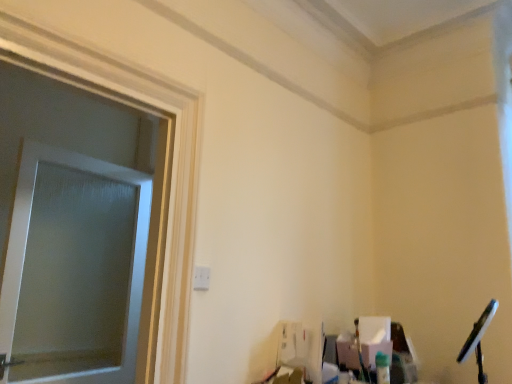
Question: Is white wood frame at left bigger than frosted glass window screen at left?

Choices:
 (A) no
 (B) yes

Answer: (B)

Question: From the image's perspective, is white wood frame at left on top of frosted glass window screen at left?

Choices:
 (A) no
 (B) yes

Answer: (B)

Question: Is frosted glass window screen at left at the back of white wood frame at left?

Choices:
 (A) no
 (B) yes

Answer: (B)

Question: Is white wood frame at left shorter than frosted glass window screen at left?

Choices:
 (A) no
 (B) yes

Answer: (A)

Question: Is white wood frame at left wider than frosted glass window screen at left?

Choices:
 (A) no
 (B) yes

Answer: (B)

Question: Is the surface of white wood frame at left in direct contact with frosted glass window screen at left?

Choices:
 (A) no
 (B) yes

Answer: (A)

Question: Considering the relative sizes of frosted glass window screen at left and white wood frame at left in the image provided, is frosted glass window screen at left wider than white wood frame at left?

Choices:
 (A) no
 (B) yes

Answer: (A)

Question: Is frosted glass window screen at left next to white wood frame at left?

Choices:
 (A) yes
 (B) no

Answer: (B)

Question: Can you confirm if frosted glass window screen at left is thinner than white wood frame at left?

Choices:
 (A) no
 (B) yes

Answer: (B)

Question: Is frosted glass window screen at left located outside white wood frame at left?

Choices:
 (A) yes
 (B) no

Answer: (A)

Question: Considering the relative sizes of frosted glass window screen at left and white wood frame at left in the image provided, is frosted glass window screen at left taller than white wood frame at left?

Choices:
 (A) yes
 (B) no

Answer: (B)

Question: From the image's perspective, is frosted glass window screen at left above white wood frame at left?

Choices:
 (A) no
 (B) yes

Answer: (A)

Question: From their relative heights in the image, would you say frosted glass window screen at left is taller or shorter than white wood frame at left?

Choices:
 (A) short
 (B) tall

Answer: (A)